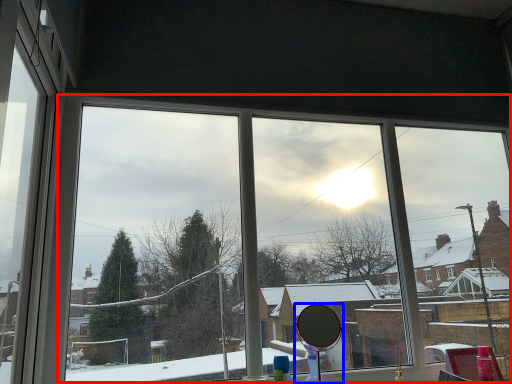
Question: Which point is further to the camera, bay window (highlighted by a red box) or mirror (highlighted by a blue box)?

Choices:
 (A) bay window
 (B) mirror

Answer: (A)